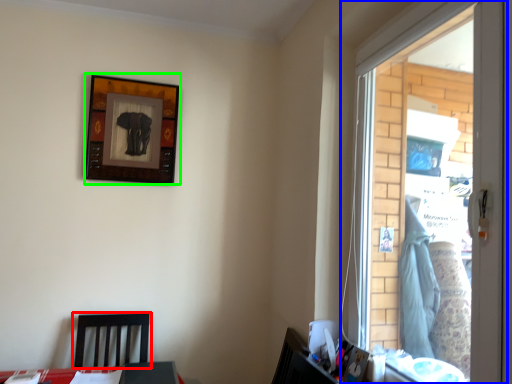
Question: Which is nearer to the furniture (highlighted by a red box)? window (highlighted by a blue box) or picture frame (highlighted by a green box).

Choices:
 (A) window
 (B) picture frame

Answer: (B)